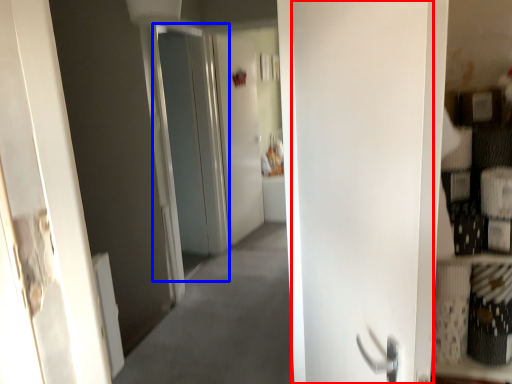
Question: Which object appears closest to the camera in this image, door (highlighted by a red box) or screen door (highlighted by a blue box)?

Choices:
 (A) door
 (B) screen door

Answer: (A)